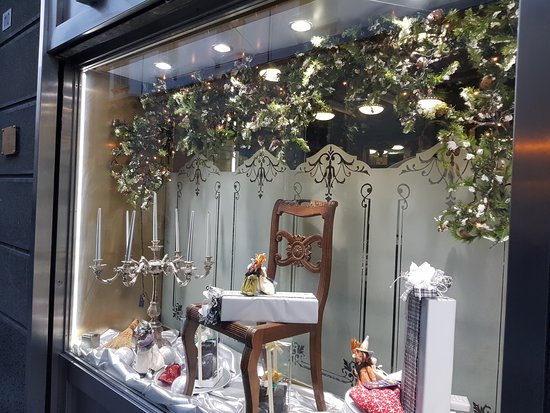
This screenshot has width=550, height=413. I want to click on window, so click(x=304, y=172).